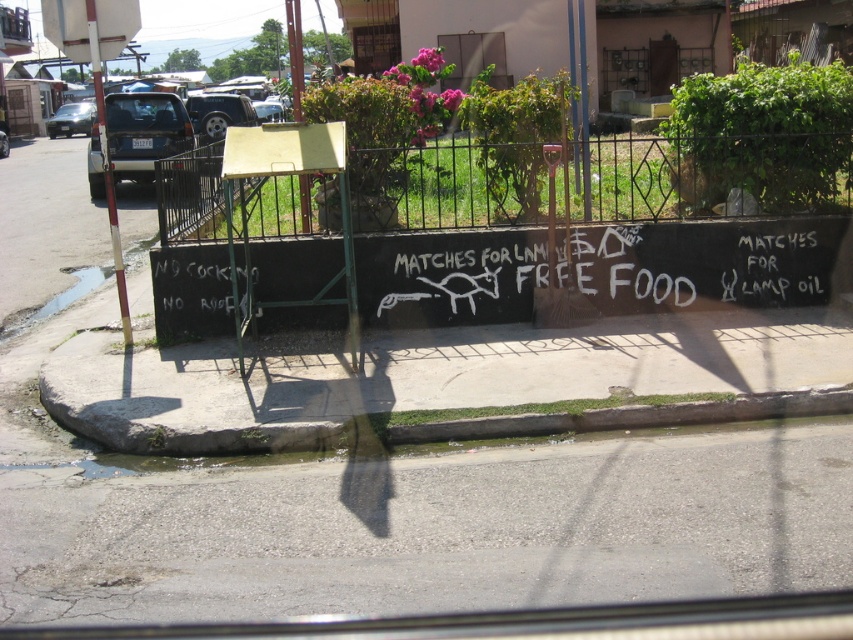
You are a pedestrian walking on the street and see the white chalk writing at center and the white chalk writing at lower left. Which one is wider?

The white chalk writing at center is wider than the white chalk writing at lower left.

Consider the image. You are a driver in a car and you see the gray concrete curb at lower center and the matte black suv at upper left through the window. Which object is closer to you?

The gray concrete curb at lower center is closer to you because it is smaller than the matte black suv at upper left, indicating it is farther away according to perspective.

You are sitting in the car and looking out the window. There are two points marked on the road ahead. Which point is closer to you, point (x=91, y=179) or point (x=88, y=128)?

Point (x=91, y=179) is closer to you than point (x=88, y=128).